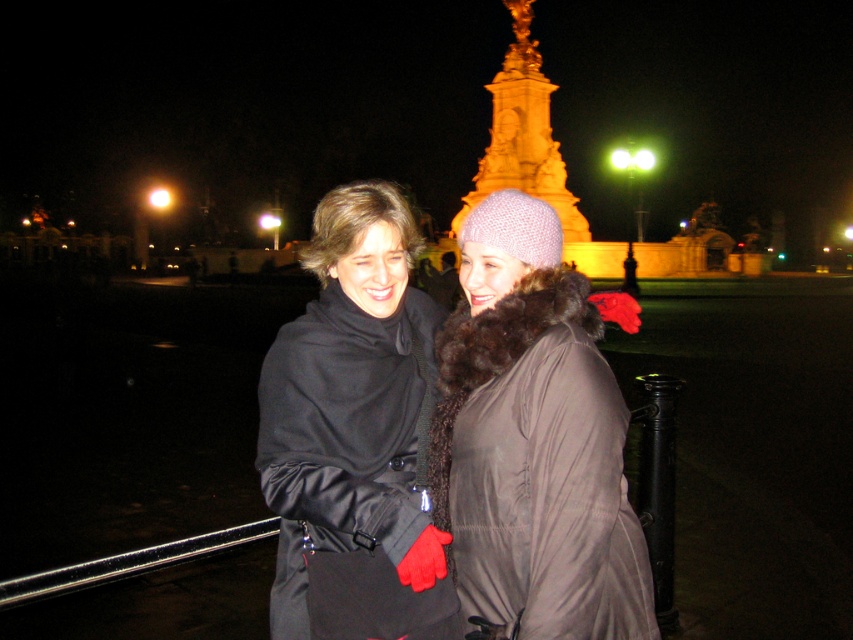
Which is in front, point (637, 616) or point (502, 116)?

Positioned in front is point (637, 616).

Which is below, knitted woolen hat at center or gold polished stone tower at upper center?

knitted woolen hat at center is lower down.

Image resolution: width=853 pixels, height=640 pixels. What do you see at coordinates (532, 440) in the screenshot?
I see `knitted woolen hat at center` at bounding box center [532, 440].

Image resolution: width=853 pixels, height=640 pixels. In order to click on knitted woolen hat at center in this screenshot , I will do `click(532, 440)`.

Between point (502, 458) and point (374, 193), which one is positioned behind?

Point (374, 193)

Does point (538, 323) come in front of point (445, 611)?

No, (538, 323) is further to viewer.

At what (x,y) coordinates should I click in order to perform the action: click on knitted woolen hat at center. Please return your answer as a coordinate pair (x, y). The height and width of the screenshot is (640, 853). Looking at the image, I should click on (532, 440).

Does point (329, 257) come closer to viewer compared to point (491, 168)?

Yes.

In the scene shown: Does matte black coat at center have a larger size compared to gold polished stone tower at upper center?

Indeed, matte black coat at center has a larger size compared to gold polished stone tower at upper center.

Who is more forward, (x=405, y=378) or (x=506, y=81)?

Point (x=405, y=378) is more forward.

The height and width of the screenshot is (640, 853). In order to click on matte black coat at center in this screenshot , I will do [354, 413].